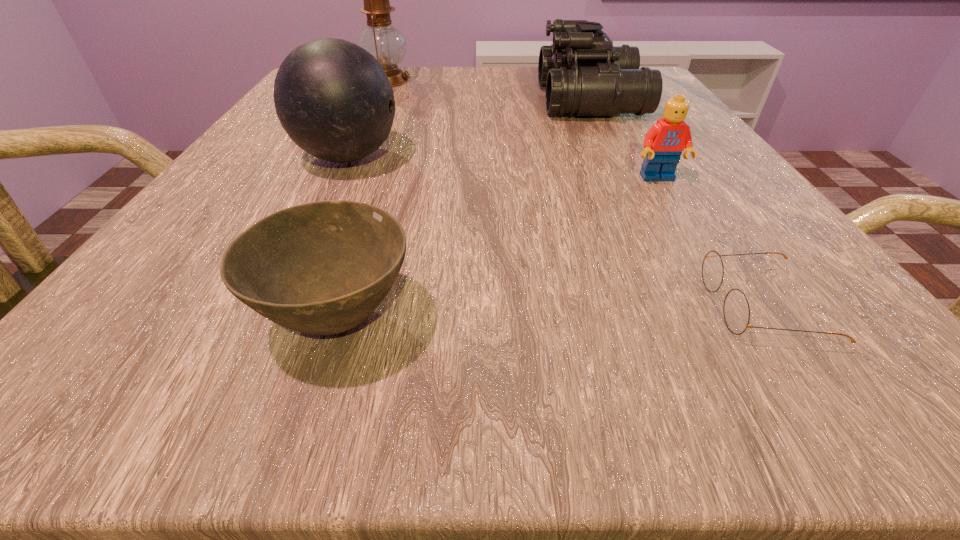
Identify the location of free space located 0.230m through the lenses of the binoculars. (426, 100).

At what (x,y) coordinates should I click in order to perform the action: click on free spot located 0.240m on the face of the Lego. Please return your answer as a coordinate pair (x, y). Looking at the image, I should click on (x=733, y=306).

You are a GUI agent. You are given a task and a screenshot of the screen. Output one action in this format:
    pyautogui.click(x=<x>, y=<y>)
    Task: Click on the free space located 0.110m on the back of the fifth tallest object
    
    Given the screenshot: What is the action you would take?
    pyautogui.click(x=372, y=214)

Find the location of `vacant space located 0.180m on the temples of the spectacles`. vacant space located 0.180m on the temples of the spectacles is located at coordinates pos(536,306).

The width and height of the screenshot is (960, 540). Identify the location of vacant space located 0.110m on the temples of the spectacles. (x=604, y=306).

Find the location of a particular element. The height and width of the screenshot is (540, 960). free space located 0.320m on the temples of the spectacles is located at coordinates (399, 306).

Where is `oil lamp located in the far edge section of the desktop`? This screenshot has width=960, height=540. oil lamp located in the far edge section of the desktop is located at coordinates (386, 43).

You are a GUI agent. You are given a task and a screenshot of the screen. Output one action in this format:
    pyautogui.click(x=<x>, y=<y>)
    Task: Click on the binoculars that is at the far edge
    
    Given the screenshot: What is the action you would take?
    pyautogui.click(x=584, y=74)

Identify the location of bowl present at the near edge. The height and width of the screenshot is (540, 960). (321, 268).

The width and height of the screenshot is (960, 540). In order to click on spectacles located in the near edge section of the desktop in this screenshot , I will do click(736, 310).